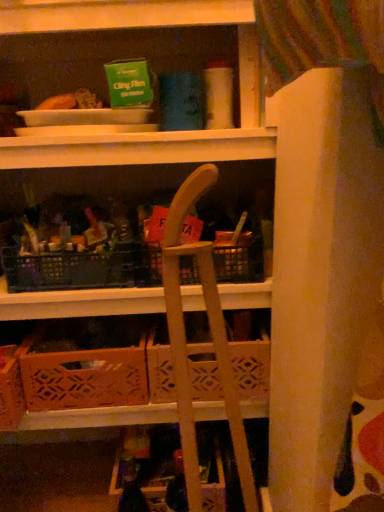
Question: From their relative heights in the image, would you say wooden crate at lower center is taller or shorter than wooden crate at center?

Choices:
 (A) tall
 (B) short

Answer: (B)

Question: Does point (74, 369) appear closer or farther from the camera than point (259, 395)?

Choices:
 (A) farther
 (B) closer

Answer: (B)

Question: Which is nearer to the wooden crate at lower center?

Choices:
 (A) wooden crate at center
 (B) wooden folding chair at center

Answer: (A)

Question: Estimate the real-world distances between objects in this image. Which object is farther from the wooden folding chair at center?

Choices:
 (A) wooden crate at center
 (B) wooden crate at lower center

Answer: (B)